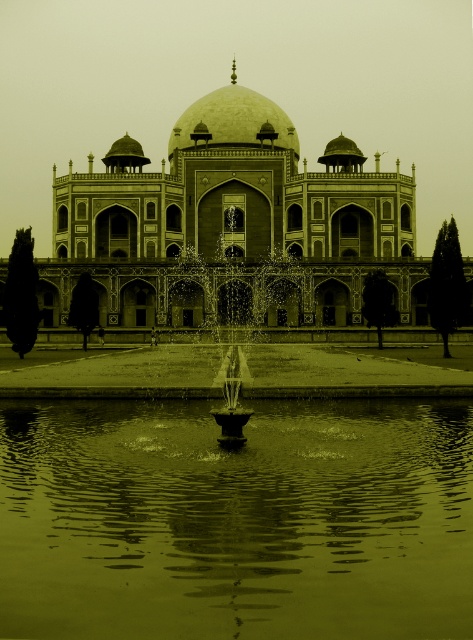
Question: Does green reflective water at center lie in front of sepia stone palace at center?

Choices:
 (A) no
 (B) yes

Answer: (B)

Question: Based on their relative distances, which object is farther from the sepia stone palace at center?

Choices:
 (A) green reflective water at center
 (B) smooth stone fountain at center

Answer: (A)

Question: Which of the following is the farthest from the observer?

Choices:
 (A) (289, 128)
 (B) (285, 317)
 (C) (10, 404)

Answer: (A)

Question: Can you confirm if green reflective water at center is positioned above sepia stone palace at center?

Choices:
 (A) yes
 (B) no

Answer: (B)

Question: Which is nearer to the sepia stone palace at center?

Choices:
 (A) smooth stone fountain at center
 (B) green reflective water at center

Answer: (A)

Question: Is green reflective water at center positioned behind smooth stone fountain at center?

Choices:
 (A) yes
 (B) no

Answer: (B)